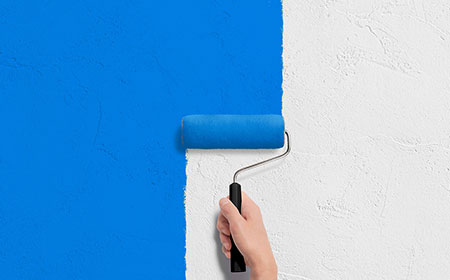
You are a GUI agent. You are given a task and a screenshot of the screen. Output one action in this format:
    pyautogui.click(x=<x>, y=<y>)
    Task: Click on the roller frame
    Image resolution: width=450 pixels, height=280 pixels.
    Given the screenshot: What is the action you would take?
    pyautogui.click(x=233, y=191)